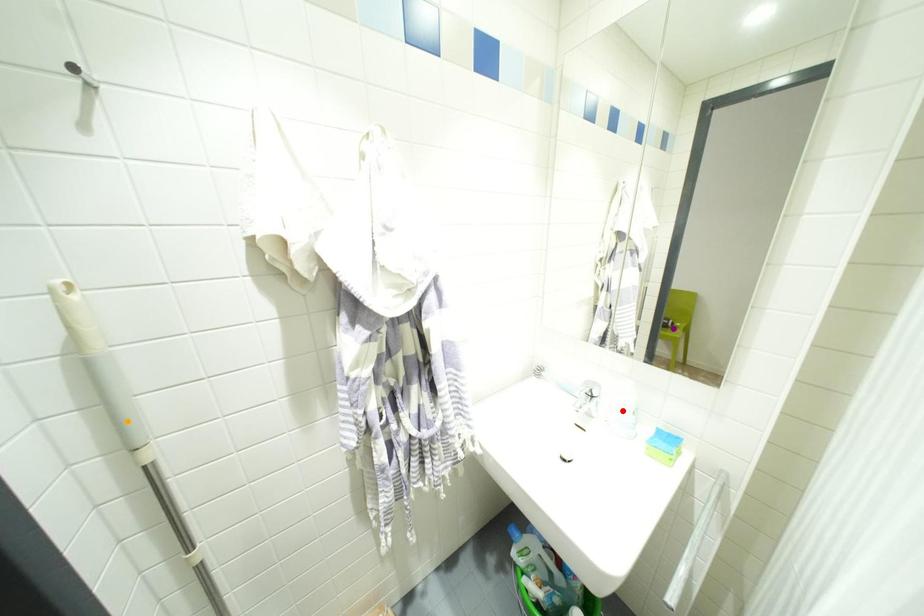
Based on the photo, order these from nearest to farthest:
1. purple point
2. orange point
3. red point

orange point
red point
purple point